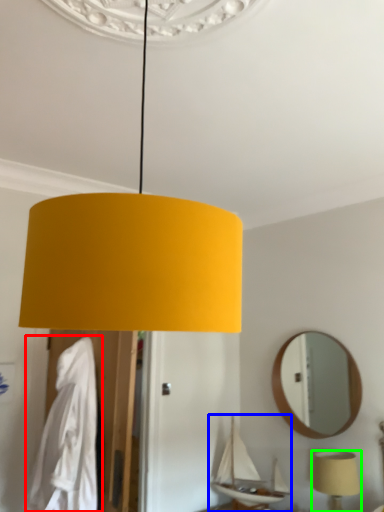
Question: Based on their relative distances, which object is nearer to robe (highlighted by a red box)? Choose from boat (highlighted by a blue box) and lamp (highlighted by a green box).

Choices:
 (A) boat
 (B) lamp

Answer: (A)